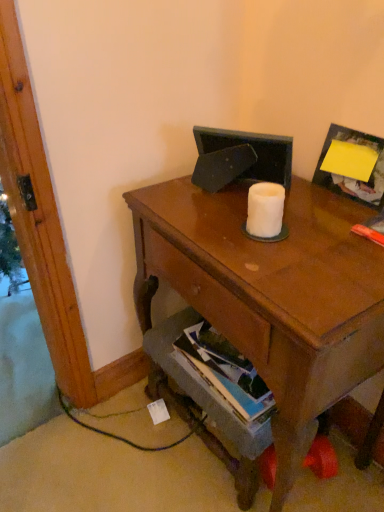
The image size is (384, 512). In order to click on unoccupied space behind white matte toilet paper at center in this screenshot , I will do `click(244, 201)`.